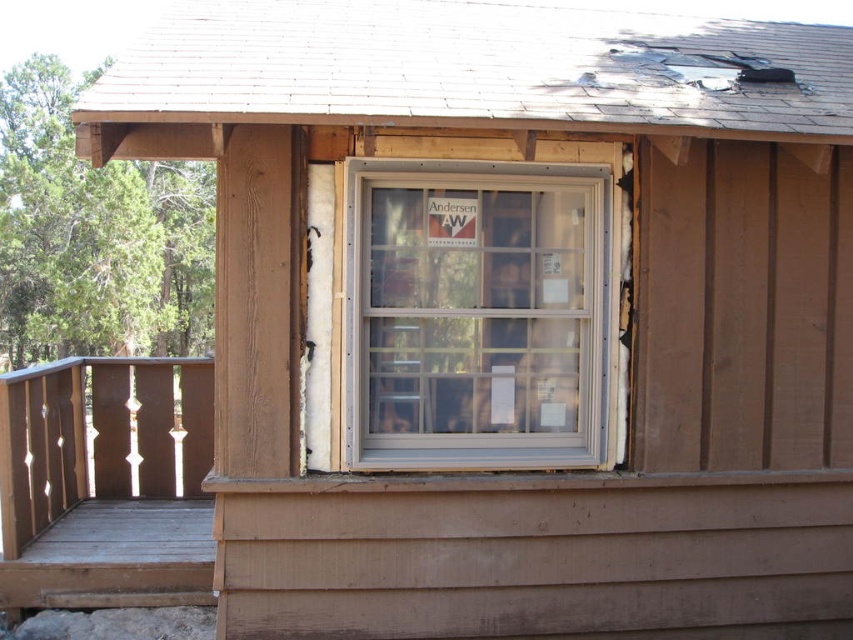
Does white plastic window at center appear on the left side of wooden porch at lower left?

In fact, white plastic window at center is to the right of wooden porch at lower left.

Which is behind, point (607, 241) or point (106, 518)?

The point (106, 518) is more distant.

Which is in front, point (590, 272) or point (7, 563)?

Point (590, 272) is more forward.

Image resolution: width=853 pixels, height=640 pixels. In order to click on white plastic window at center in this screenshot , I will do `click(474, 314)`.